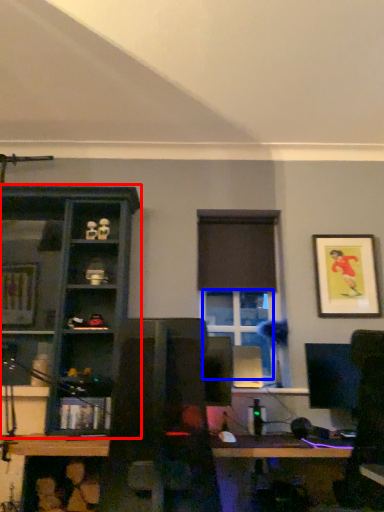
Question: Which object appears farthest to the camera in this image, shelf (highlighted by a red box) or window (highlighted by a blue box)?

Choices:
 (A) shelf
 (B) window

Answer: (B)